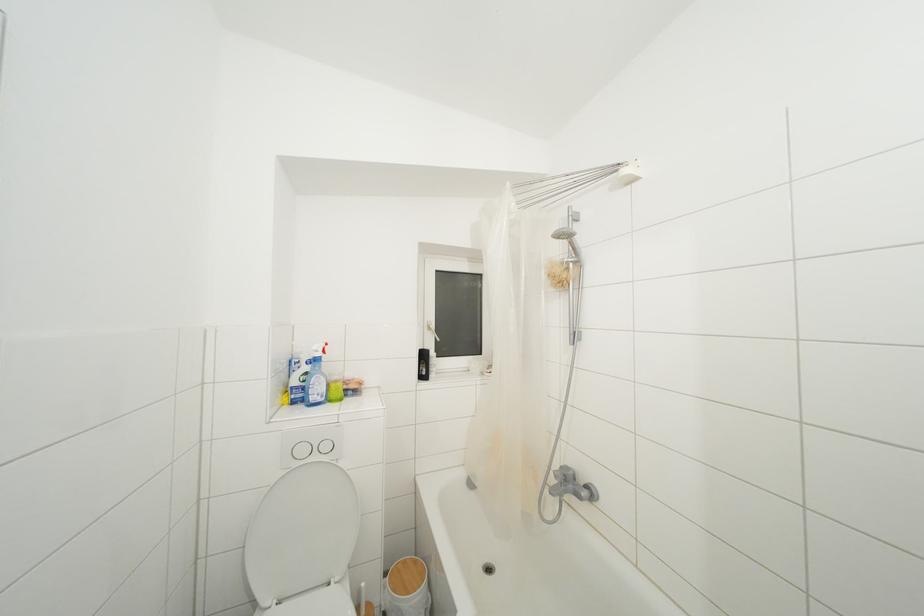
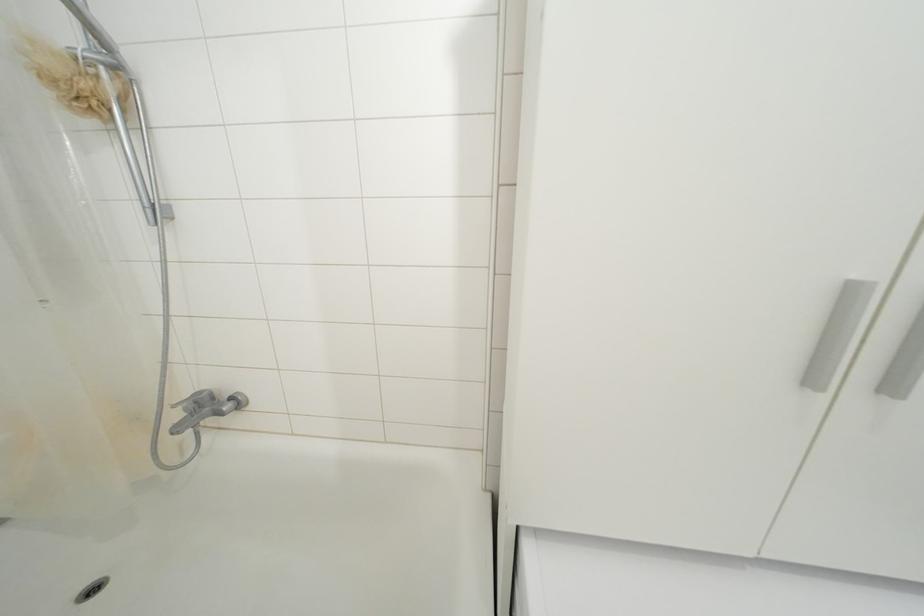
How did the camera likely rotate?

The camera's rotation is toward right-down.